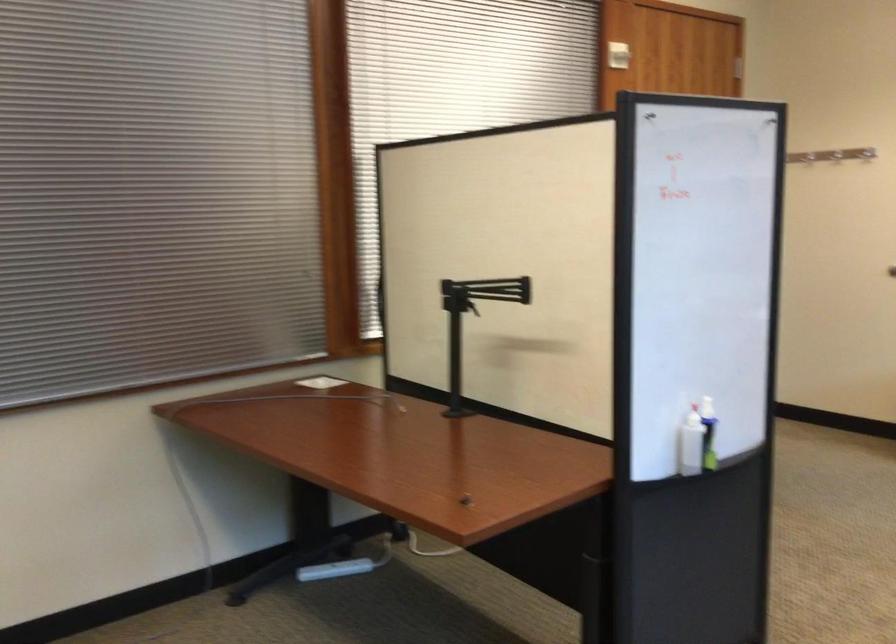
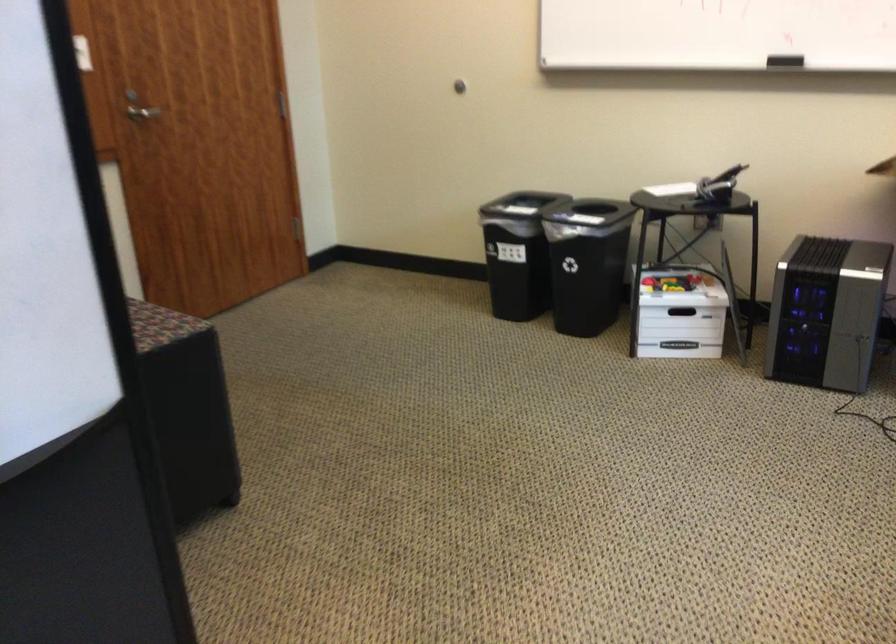
Which direction would the cameraman need to move to produce the second image?

The cameraman moved toward right, forward.